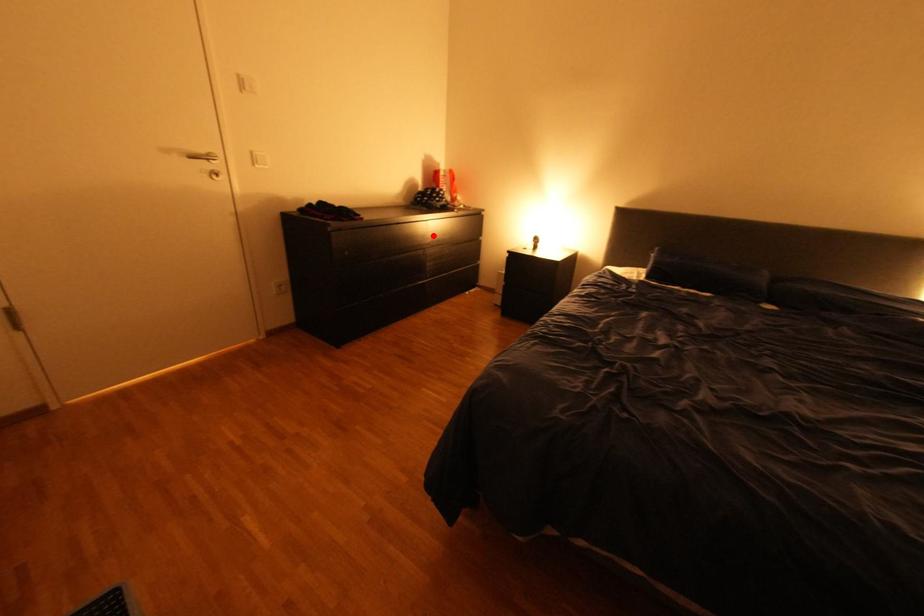
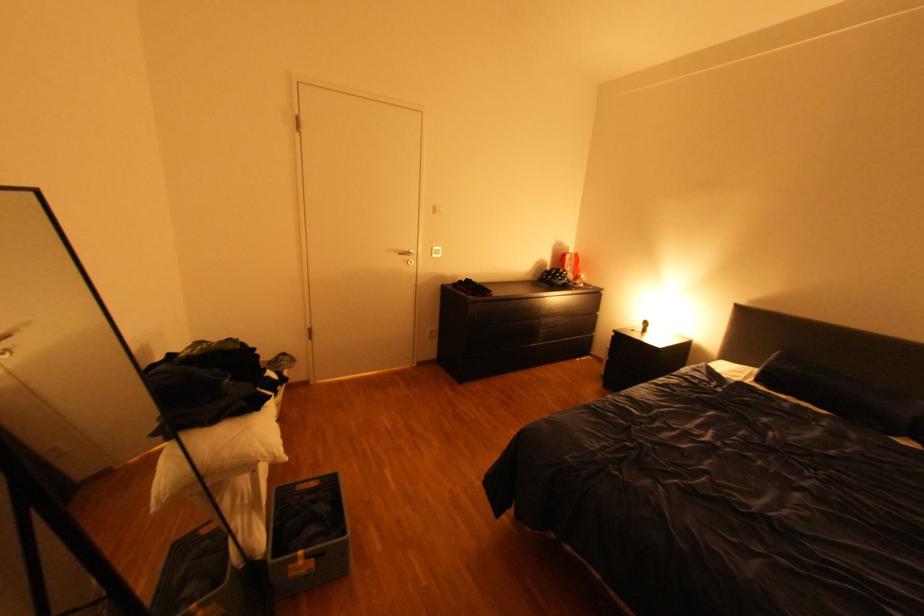
Locate, in the second image, the point that corresponds to the highlighted location in the first image.

(550, 309)